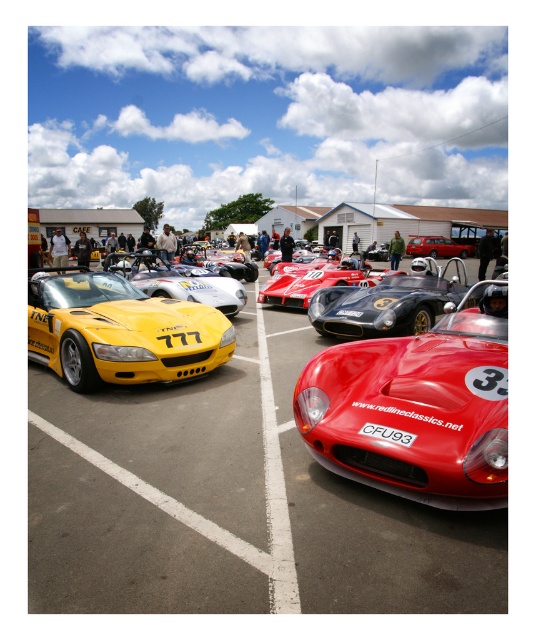
Based on the photo, is shiny yellow sports car at left bigger than metallic silver sports car at center?

No, shiny yellow sports car at left is not bigger than metallic silver sports car at center.

Does shiny yellow sports car at left appear on the right side of metallic silver sports car at center?

No, shiny yellow sports car at left is not to the right of metallic silver sports car at center.

Is point (35, 304) farther from viewer compared to point (460, 253)?

No, it is not.

The height and width of the screenshot is (640, 536). I want to click on shiny yellow sports car at left, so click(120, 332).

Does shiny red racing car at center appear over shiny black race car at center?

No.

Is shiny red racing car at center below shiny black race car at center?

Yes, shiny red racing car at center is below shiny black race car at center.

Locate an element on the screen. The height and width of the screenshot is (640, 536). shiny red racing car at center is located at coordinates (414, 412).

Image resolution: width=536 pixels, height=640 pixels. Identify the location of shiny red racing car at center. (414, 412).

This screenshot has width=536, height=640. Find the location of `shiny yellow car at left`. shiny yellow car at left is located at coordinates (232, 502).

Which of these two, shiny yellow car at left or metallic silver sports car at center, stands shorter?

Standing shorter between the two is shiny yellow car at left.

Identify the location of shiny yellow car at left. (232, 502).